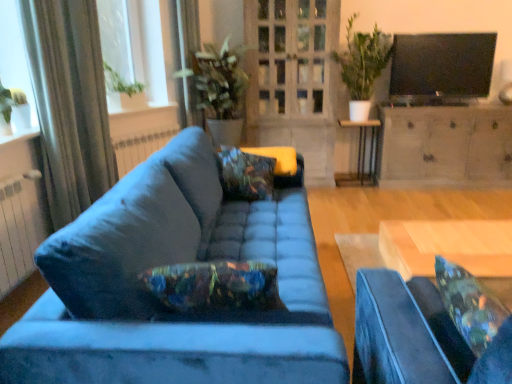
Where is `green leafy plant at upper center, which appears as the second houseplant when viewed from the left`? The image size is (512, 384). green leafy plant at upper center, which appears as the second houseplant when viewed from the left is located at coordinates (362, 66).

Find the location of a particular element. The height and width of the screenshot is (384, 512). green fabric curtain at upper left, the 2th curtain from the front is located at coordinates (188, 30).

Locate an element on the screen. Image resolution: width=512 pixels, height=384 pixels. clear glass window at upper left is located at coordinates (15, 54).

This screenshot has width=512, height=384. What do you see at coordinates (405, 333) in the screenshot? I see `velvet blue studio couch at center, the second studio couch from the left` at bounding box center [405, 333].

What is the approximate width of white metallic radiator at lower left, marked as the first radiator in a left-to-right arrangement?

white metallic radiator at lower left, marked as the first radiator in a left-to-right arrangement, is 5.58 inches in width.

The width and height of the screenshot is (512, 384). What do you see at coordinates (361, 154) in the screenshot? I see `black metal side table at center` at bounding box center [361, 154].

At what (x,y) coordinates should I click in order to perform the action: click on black metal side table at center. Please return your answer as a coordinate pair (x, y). This screenshot has height=384, width=512. Looking at the image, I should click on (361, 154).

The height and width of the screenshot is (384, 512). I want to click on floral fabric pillow at center, so click(x=246, y=175).

This screenshot has width=512, height=384. What do you see at coordinates (10, 101) in the screenshot? I see `green leafy plant at upper left` at bounding box center [10, 101].

I want to click on green leafy plant at upper center, which appears as the second houseplant when viewed from the left, so click(x=362, y=66).

Which radiator is the 1st one when counting from the left side of the green leafy plant at upper center, which is counted as the first houseplant, starting from the right? Please provide its 2D coordinates.

[(139, 147)]

Between point (125, 158) and point (361, 106), which one is positioned in front?

The point (125, 158) is more forward.

Could you tell me if matte white radiator at left, the first radiator viewed from the back, is facing green leafy plant at upper center, which appears as the second houseplant when viewed from the left?

No, matte white radiator at left, the first radiator viewed from the back, is not turned towards green leafy plant at upper center, which appears as the second houseplant when viewed from the left.

Is black glossy tv at upper right surrounded by green fabric curtain at upper left, placed as the second curtain when sorted from left to right?

No, black glossy tv at upper right is not surrounded by green fabric curtain at upper left, placed as the second curtain when sorted from left to right.

Who is smaller, green fabric curtain at upper left, the first curtain from the back, or black glossy tv at upper right?

green fabric curtain at upper left, the first curtain from the back.

Considering the points (199, 50) and (492, 46), which point is in front, point (199, 50) or point (492, 46)?

Positioned in front is point (199, 50).

From the picture: Considering the sizes of objects silky beige curtain at left, placed as the 1th curtain when sorted from front to back, and clear glass window at upper left in the image provided, who is taller, silky beige curtain at left, placed as the 1th curtain when sorted from front to back, or clear glass window at upper left?

silky beige curtain at left, placed as the 1th curtain when sorted from front to back, is taller.

Looking at this image, considering the sizes of objects silky beige curtain at left, placed as the 1th curtain when sorted from front to back, and clear glass window at upper left in the image provided, who is wider, silky beige curtain at left, placed as the 1th curtain when sorted from front to back, or clear glass window at upper left?

With larger width is clear glass window at upper left.

Is silky beige curtain at left, arranged as the first curtain when viewed from the left, beside clear glass window at upper left?

silky beige curtain at left, arranged as the first curtain when viewed from the left, and clear glass window at upper left are clearly separated.

From the image's perspective, does silky beige curtain at left, arranged as the 2th curtain when viewed from the back, appear higher than clear glass window at upper left?

No.

Does floral fabric pillow at center have a lesser width compared to green leafy plant at upper center, the 2th houseplant when ordered from right to left?

Yes.

Is floral fabric pillow at center far from green leafy plant at upper center, the 1th houseplant from the left?

Yes, floral fabric pillow at center and green leafy plant at upper center, the 1th houseplant from the left, are located far from each other.

Are wooden desk at center and silky beige curtain at left, arranged as the 2th curtain when viewed from the back, located far from each other?

Yes.

From the image's perspective, between wooden desk at center and silky beige curtain at left, which is the second curtain in right-to-left order, who is located below?

wooden desk at center appears lower in the image.

Is silky beige curtain at left, placed as the 1th curtain when sorted from front to back, at the back of wooden desk at center?

That's not correct — wooden desk at center is not looking away from silky beige curtain at left, placed as the 1th curtain when sorted from front to back.

Considering the relative positions of wooden desk at center and white metallic radiator at lower left, acting as the 1th radiator starting from the front, in the image provided, is wooden desk at center behind white metallic radiator at lower left, acting as the 1th radiator starting from the front,?

No, it is in front of white metallic radiator at lower left, acting as the 1th radiator starting from the front.

Looking at this image, between wooden desk at center and white metallic radiator at lower left, marked as the first radiator in a left-to-right arrangement, which one has smaller size?

With smaller size is wooden desk at center.

Looking at the image, does wooden desk at center seem bigger or smaller compared to clear glass window at upper left?

In the image, wooden desk at center appears to be smaller than clear glass window at upper left.

Looking at this image, from a real-world perspective, is wooden desk at center positioned under clear glass window at upper left based on gravity?

Yes, from a real-world perspective, wooden desk at center is under clear glass window at upper left.

Considering the relative positions of wooden desk at center and clear glass window at upper left in the image provided, is wooden desk at center to the right of clear glass window at upper left from the viewer's perspective?

Yes.

Can you see wooden desk at center touching clear glass window at upper left?

No, wooden desk at center is not touching clear glass window at upper left.

Locate an element on the screen. The image size is (512, 384). houseplant that is the 2nd one when counting upward from the matte white radiator at left, the 1th radiator when ordered from top to bottom (from the image's perspective) is located at coordinates (362, 66).

Locate an element on the screen. Image resolution: width=512 pixels, height=384 pixels. television directly beneath the green fabric curtain at upper left, the first curtain from the back (from a real-world perspective) is located at coordinates (441, 67).

Looking at the image, which one is located closer to velvet blue studio couch at center, the second studio couch from the left, green leafy plant at upper left or white metallic radiator at lower left, the second radiator in the back-to-front sequence?

white metallic radiator at lower left, the second radiator in the back-to-front sequence, is closer to velvet blue studio couch at center, the second studio couch from the left.

Looking at the image, which one is located closer to transparent glass window screen at upper left, matte white radiator at left, the 2th radiator ordered from the bottom, or green leafy plant at upper center, the 1th houseplant from the left?

green leafy plant at upper center, the 1th houseplant from the left, is closer to transparent glass window screen at upper left.

Based on their spatial positions, is white metallic radiator at lower left, acting as the 1th radiator starting from the front, or matte gray cabinet at center right further from matte white radiator at left, the first radiator viewed from the back?

matte gray cabinet at center right is positioned further to the anchor matte white radiator at left, the first radiator viewed from the back.

Considering their positions, is transparent glass window screen at upper left positioned further to suede blue couch at center, which ranks as the 2th studio couch in right-to-left order, than clear glass door at center?

clear glass door at center is further to suede blue couch at center, which ranks as the 2th studio couch in right-to-left order.

From the image, which object appears to be farther from transparent glass window screen at upper left, clear glass window at upper left or floral fabric pillow at center?

Based on the image, floral fabric pillow at center appears to be further to transparent glass window screen at upper left.

Estimate the real-world distances between objects in this image. Which object is further from transparent glass window screen at upper left, black glossy tv at upper right or floral fabric pillow at center?

The object further to transparent glass window screen at upper left is black glossy tv at upper right.

Which object lies further to the anchor point white metallic radiator at lower left, which appears as the 2th radiator when viewed from the right, velvet blue studio couch at center, the second studio couch from the left, or green leafy plant at upper center, which is counted as the first houseplant, starting from the right?

green leafy plant at upper center, which is counted as the first houseplant, starting from the right, is further to white metallic radiator at lower left, which appears as the 2th radiator when viewed from the right.

When comparing their distances from white metallic radiator at lower left, the second radiator viewed from the top, does clear glass door at center or green leafy plant at upper left seem further?

clear glass door at center lies further to white metallic radiator at lower left, the second radiator viewed from the top, than the other object.

Locate an element on the screen. window located between white metallic radiator at lower left, marked as the first radiator in a left-to-right arrangement, and matte white radiator at left, the 2th radiator ordered from the bottom, in the depth direction is located at coordinates (15, 54).

In order to click on glass door between green fabric curtain at upper left, the first curtain from the back, and black metal side table at center from left to right in this screenshot , I will do `click(293, 79)`.

This screenshot has width=512, height=384. What are the coordinates of `plant between white metallic radiator at lower left, the 1th radiator positioned from the bottom, and green fabric curtain at upper left, the 2th curtain from the front, in the front-back direction` in the screenshot? It's located at pyautogui.click(x=10, y=101).

This screenshot has height=384, width=512. Identify the location of studio couch between velvet blue studio couch at center, the second studio couch from the left, and transparent glass window screen at upper left from front to back. (172, 262).